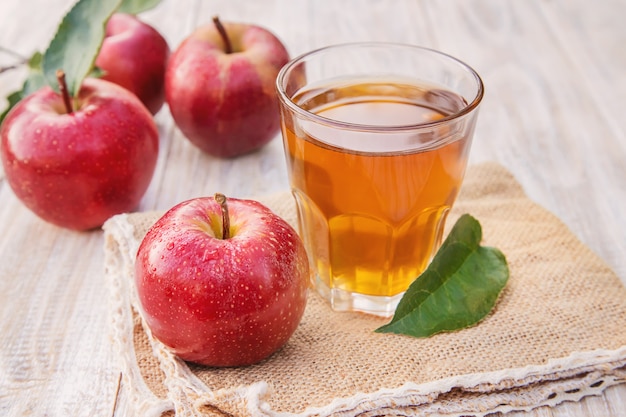
At what (x,y) coordinates should I click in order to perform the action: click on napkin. Please return your answer as a coordinate pair (x, y). Looking at the image, I should click on (377, 357).